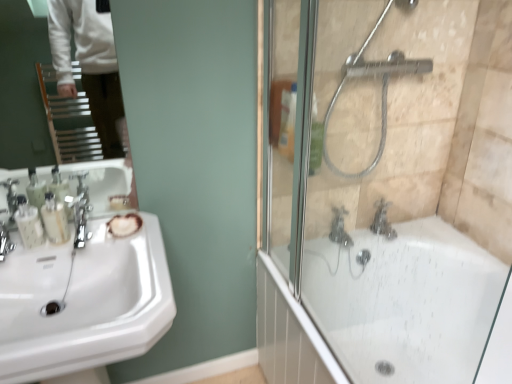
The image size is (512, 384). In order to click on polished chrome faucet at left, the 2th faucet viewed from the left in this screenshot , I will do `click(81, 224)`.

In order to face silver metallic showerhead at upper right, should I rotate leftwards or rightwards?

You should look right and rotate roughly 17.186 degrees.

Describe the element at coordinates (381, 309) in the screenshot. I see `white glossy bathtub at right` at that location.

You are a GUI agent. You are given a task and a screenshot of the screen. Output one action in this format:
    pyautogui.click(x=<x>, y=<y>)
    Task: Click on the silver metallic mirror at upper left
    This screenshot has height=384, width=512.
    Given the screenshot: What is the action you would take?
    tap(22, 88)

Image resolution: width=512 pixels, height=384 pixels. Describe the element at coordinates (22, 88) in the screenshot. I see `silver metallic mirror at upper left` at that location.

Identify the location of polished chrome faucet at left, the 2th faucet viewed from the left. (81, 224).

Between polished chrome faucet at left, the 1th faucet viewed from the right, and translucent glass shower door at right, which one has less height?

With less height is polished chrome faucet at left, the 1th faucet viewed from the right.

How much distance is there between polished chrome faucet at left, the 1th faucet viewed from the right, and translucent glass shower door at right?

They are 39.32 inches apart.

How many degrees apart are the facing directions of polished chrome faucet at left, the 1th faucet viewed from the right, and translucent glass shower door at right?

5.74 degrees.

Is there a large distance between polished chrome faucet at left, the 2th faucet viewed from the left, and translucent glass shower door at right?

They are positioned close to each other.

How many degrees apart are the facing directions of silver metallic showerhead at upper right and satin nickel faucet at lower right, the 2th tap viewed from the left?

The facing directions of silver metallic showerhead at upper right and satin nickel faucet at lower right, the 2th tap viewed from the left, are 0.039 degrees apart.

In the scene shown: Is silver metallic showerhead at upper right thinner than satin nickel faucet at lower right, the 2th tap viewed from the left?

In fact, silver metallic showerhead at upper right might be wider than satin nickel faucet at lower right, the 2th tap viewed from the left.

Which of these two, silver metallic showerhead at upper right or satin nickel faucet at lower right, arranged as the first tap when viewed from the right, is smaller?

With smaller size is satin nickel faucet at lower right, arranged as the first tap when viewed from the right.

Can we say silver metallic showerhead at upper right lies outside satin nickel faucet at lower right, arranged as the first tap when viewed from the right?

Yes, silver metallic showerhead at upper right is located beyond the bounds of satin nickel faucet at lower right, arranged as the first tap when viewed from the right.

Is white glossy sink at left inside or outside of silver metallic showerhead at upper right?

white glossy sink at left cannot be found inside silver metallic showerhead at upper right.

Does point (121, 329) appear closer or farther from the camera than point (355, 54)?

Point (121, 329) is positioned closer to the camera compared to point (355, 54).

From a real-world perspective, does white glossy sink at left sit lower than silver metallic showerhead at upper right?

Indeed, from a real-world perspective, white glossy sink at left is positioned beneath silver metallic showerhead at upper right.

Looking at this image, which object is further away from the camera, white glossy sink at left or silver metallic showerhead at upper right?

silver metallic showerhead at upper right is behind.

Which object is thinner, silver metallic faucet at lower right, marked as the 1th tap in a left-to-right arrangement, or polished chrome faucet at left, the 2th faucet viewed from the left?

polished chrome faucet at left, the 2th faucet viewed from the left, is thinner.

Is there a large distance between silver metallic faucet at lower right, which is counted as the second tap, starting from the right, and polished chrome faucet at left, the 2th faucet viewed from the left?

That's not correct — silver metallic faucet at lower right, which is counted as the second tap, starting from the right, is a little close to polished chrome faucet at left, the 2th faucet viewed from the left.

This screenshot has height=384, width=512. Identify the location of faucet that is the 1st one when counting leftward from the silver metallic faucet at lower right, marked as the 1th tap in a left-to-right arrangement. (81, 224).

From the image's perspective, between silver metallic faucet at lower right, which is counted as the second tap, starting from the right, and polished chrome faucet at left, the 1th faucet viewed from the right, who is located below?

silver metallic faucet at lower right, which is counted as the second tap, starting from the right, appears lower in the image.

Between translucent plastic soap dispenser at left, positioned as the first toiletry in right-to-left order, and white glossy bathtub at right, which one has larger size?

Bigger between the two is white glossy bathtub at right.

Which object is positioned more to the left, translucent plastic soap dispenser at left, the second toiletry from the left, or white glossy bathtub at right?

translucent plastic soap dispenser at left, the second toiletry from the left.

Can you tell me how much translucent plastic soap dispenser at left, positioned as the first toiletry in right-to-left order, and white glossy bathtub at right differ in facing direction?

The angle between the facing direction of translucent plastic soap dispenser at left, positioned as the first toiletry in right-to-left order, and the facing direction of white glossy bathtub at right is 86 degrees.

From the picture: Considering the relative sizes of translucent plastic soap dispenser at left, the second toiletry from the left, and white glossy bathtub at right in the image provided, is translucent plastic soap dispenser at left, the second toiletry from the left, shorter than white glossy bathtub at right?

Indeed, translucent plastic soap dispenser at left, the second toiletry from the left, has a lesser height compared to white glossy bathtub at right.

Relative to translucent glass shower door at right, is silver metallic mirror at upper left in front or behind?

Clearly, silver metallic mirror at upper left is in front of translucent glass shower door at right.

Which is more to the left, silver metallic mirror at upper left or translucent glass shower door at right?

Positioned to the left is silver metallic mirror at upper left.

Considering the sizes of objects silver metallic mirror at upper left and translucent glass shower door at right in the image provided, who is smaller, silver metallic mirror at upper left or translucent glass shower door at right?

silver metallic mirror at upper left.

In terms of width, does silver metallic mirror at upper left look wider or thinner when compared to translucent glass shower door at right?

In the image, silver metallic mirror at upper left appears to be more narrow than translucent glass shower door at right.

Is satin nickel faucet at left, positioned as the 2th faucet in right-to-left order, wider than silver metallic mirror at upper left?

Yes.

Is satin nickel faucet at left, positioned as the 2th faucet in right-to-left order, located outside silver metallic mirror at upper left?

Yes.

Considering the relative sizes of satin nickel faucet at left, positioned as the 2th faucet in right-to-left order, and silver metallic mirror at upper left in the image provided, is satin nickel faucet at left, positioned as the 2th faucet in right-to-left order, smaller than silver metallic mirror at upper left?

Correct, satin nickel faucet at left, positioned as the 2th faucet in right-to-left order, occupies less space than silver metallic mirror at upper left.

From a real-world perspective, is satin nickel faucet at left, positioned as the 2th faucet in right-to-left order, beneath silver metallic mirror at upper left?

Yes, from a real-world perspective, satin nickel faucet at left, positioned as the 2th faucet in right-to-left order, is beneath silver metallic mirror at upper left.

Where is `screen door above the polished chrome faucet at left, the 1th faucet viewed from the right (from a real-world perspective)`? This screenshot has height=384, width=512. screen door above the polished chrome faucet at left, the 1th faucet viewed from the right (from a real-world perspective) is located at coordinates (388, 198).

Locate an element on the screen. The image size is (512, 384). tap on the right of silver metallic showerhead at upper right is located at coordinates (382, 220).

Based on their spatial positions, is satin nickel faucet at lower right, arranged as the first tap when viewed from the right, or silver metallic mirror at upper left closer to translucent plastic soap dispenser at left, the second toiletry from the left?

Based on the image, silver metallic mirror at upper left appears to be nearer to translucent plastic soap dispenser at left, the second toiletry from the left.

Considering their positions, is matte white toothbrushes at left, which appears as the 1th toiletry when viewed from the left, positioned further to white glossy sink at left than white glossy bathtub at right?

white glossy bathtub at right is further to white glossy sink at left.

Based on their spatial positions, is polished chrome faucet at left, the 1th faucet viewed from the right, or translucent glass shower door at right closer to matte white toothbrushes at left, the second toiletry positioned from the right?

Among the two, polished chrome faucet at left, the 1th faucet viewed from the right, is located nearer to matte white toothbrushes at left, the second toiletry positioned from the right.

Based on their spatial positions, is matte white toothbrushes at left, the second toiletry positioned from the right, or silver metallic mirror at upper left further from white glossy sink at left?

Among the two, silver metallic mirror at upper left is located further to white glossy sink at left.

From the image, which object appears to be farther from satin nickel faucet at left, marked as the first faucet in a left-to-right arrangement, silver metallic mirror at upper left or translucent plastic soap dispenser at left, positioned as the first toiletry in right-to-left order?

silver metallic mirror at upper left is further to satin nickel faucet at left, marked as the first faucet in a left-to-right arrangement.

Looking at the image, which one is located closer to silver metallic showerhead at upper right, silver metallic mirror at upper left or polished chrome faucet at left, the 2th faucet viewed from the left?

silver metallic mirror at upper left.

Based on their spatial positions, is silver metallic showerhead at upper right or satin nickel faucet at left, marked as the first faucet in a left-to-right arrangement, further from satin nickel faucet at lower right, arranged as the first tap when viewed from the right?

Based on the image, satin nickel faucet at left, marked as the first faucet in a left-to-right arrangement, appears to be further to satin nickel faucet at lower right, arranged as the first tap when viewed from the right.

Which object lies further to the anchor point white glossy bathtub at right, translucent glass shower door at right or silver metallic showerhead at upper right?

silver metallic showerhead at upper right.

Where is `tap between silver metallic mirror at upper left and translucent glass shower door at right from left to right`? The height and width of the screenshot is (384, 512). tap between silver metallic mirror at upper left and translucent glass shower door at right from left to right is located at coordinates (339, 228).

Locate an element on the screen. The width and height of the screenshot is (512, 384). toiletry between matte white toothbrushes at left, which appears as the 1th toiletry when viewed from the left, and translucent glass shower door at right is located at coordinates (55, 219).

Where is `toiletry between matte white toothbrushes at left, which appears as the 1th toiletry when viewed from the left, and white glossy bathtub at right from left to right`? This screenshot has height=384, width=512. toiletry between matte white toothbrushes at left, which appears as the 1th toiletry when viewed from the left, and white glossy bathtub at right from left to right is located at coordinates (55, 219).

Identify the location of faucet between silver metallic mirror at upper left and satin nickel faucet at left, positioned as the 2th faucet in right-to-left order, in the vertical direction. The height and width of the screenshot is (384, 512). (x=81, y=224).